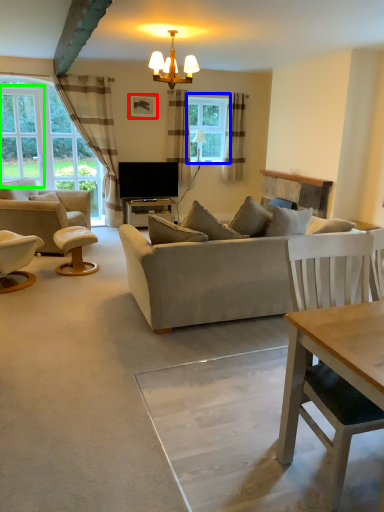
Question: Based on their relative distances, which object is farther from picture frame (highlighted by a red box)? Choose from window (highlighted by a blue box) and window screen (highlighted by a green box).

Choices:
 (A) window
 (B) window screen

Answer: (B)